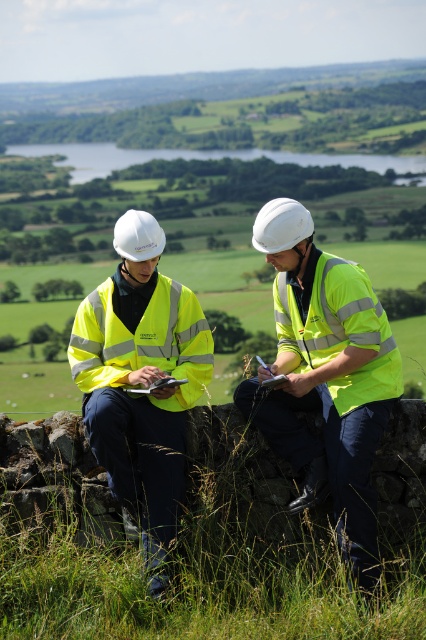
You are a drone operator trying to locate a specific point in the image. The point is marked at coordinates point (325, 376). What object is located at this point?

The point (325, 376) corresponds to the yellow reflective vest at center.